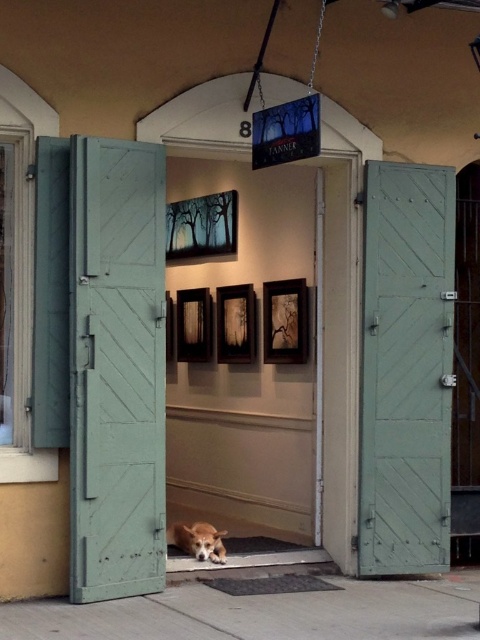
You are a delivery person with a package that is 1.2 meters wide. You need to enter the building through the entrance shown. Can the package fit through the gap between the green wood door at right and the brown fur dog at center?

The green wood door at right is wider than the brown fur dog at center. However, the exact width of the gap between them isn not specified in the provided information. Therefore, it is impossible to determine if the package will fit through the gap based on the given details.

You are standing at the entrance of the building and want to let a brown fur dog at center inside through the teal wood door at left. Can you do that?

The teal wood door at left is in front of the brown fur dog at center, so you can open the teal wood door at left and allow the brown fur dog at center to pass through.